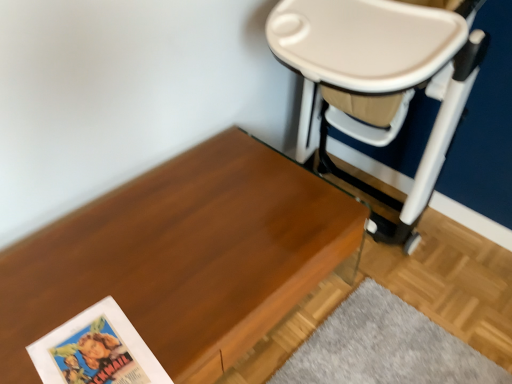
Question: From a real-world perspective, is matte paper paperback book at lower left beneath wooden table at lower left?

Choices:
 (A) no
 (B) yes

Answer: (A)

Question: Is wooden table at lower left at the back of matte paper paperback book at lower left?

Choices:
 (A) yes
 (B) no

Answer: (A)

Question: Is matte paper paperback book at lower left not within wooden table at lower left?

Choices:
 (A) no
 (B) yes

Answer: (A)

Question: Is matte paper paperback book at lower left to the right of wooden table at lower left from the viewer's perspective?

Choices:
 (A) no
 (B) yes

Answer: (A)

Question: Is matte paper paperback book at lower left at the left side of wooden table at lower left?

Choices:
 (A) yes
 (B) no

Answer: (A)

Question: Would you say beige plastic swivel chair at upper right is inside or outside matte paper paperback book at lower left?

Choices:
 (A) inside
 (B) outside

Answer: (B)

Question: From a real-world perspective, is beige plastic swivel chair at upper right positioned above or below matte paper paperback book at lower left?

Choices:
 (A) below
 (B) above

Answer: (B)

Question: Is beige plastic swivel chair at upper right taller or shorter than matte paper paperback book at lower left?

Choices:
 (A) short
 (B) tall

Answer: (B)

Question: Is beige plastic swivel chair at upper right in front of or behind matte paper paperback book at lower left in the image?

Choices:
 (A) front
 (B) behind

Answer: (A)

Question: Based on their positions, is wooden table at lower left located to the left or right of matte paper paperback book at lower left?

Choices:
 (A) right
 (B) left

Answer: (A)

Question: In terms of height, does wooden table at lower left look taller or shorter compared to matte paper paperback book at lower left?

Choices:
 (A) tall
 (B) short

Answer: (A)

Question: From a real-world perspective, relative to matte paper paperback book at lower left, is wooden table at lower left vertically above or below?

Choices:
 (A) above
 (B) below

Answer: (B)

Question: Looking at their shapes, would you say wooden table at lower left is wider or thinner than matte paper paperback book at lower left?

Choices:
 (A) wide
 (B) thin

Answer: (A)

Question: Is matte paper paperback book at lower left to the left or to the right of beige plastic swivel chair at upper right in the image?

Choices:
 (A) right
 (B) left

Answer: (B)

Question: From the image's perspective, is matte paper paperback book at lower left above or below beige plastic swivel chair at upper right?

Choices:
 (A) below
 (B) above

Answer: (A)